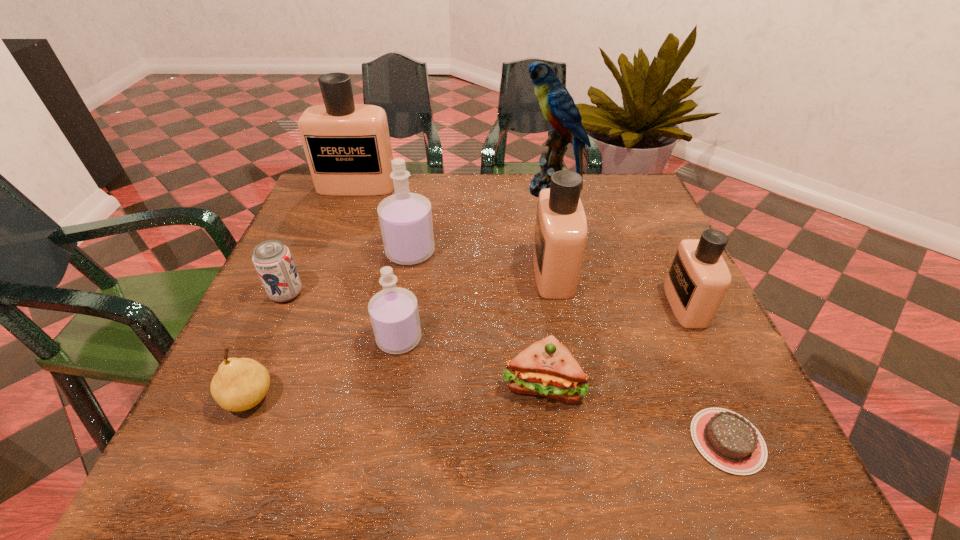
Find the location of a particular element. The image size is (960, 540). parrot is located at coordinates (558, 107).

Find the location of `the biggest beige perfume`. the biggest beige perfume is located at coordinates (347, 146).

This screenshot has height=540, width=960. In order to click on the farthest beige perfume in this screenshot , I will do `click(347, 146)`.

You are a GUI agent. You are given a task and a screenshot of the screen. Output one action in this format:
    pyautogui.click(x=<x>, y=<y>)
    Task: Click on the second smallest beige perfume
    This screenshot has width=960, height=540.
    Given the screenshot: What is the action you would take?
    pyautogui.click(x=560, y=236)

What are the coordinates of `the second beige perfume from right to left` in the screenshot? It's located at (560, 236).

This screenshot has width=960, height=540. In order to click on the bigger purple perfume in this screenshot , I will do `click(405, 218)`.

Image resolution: width=960 pixels, height=540 pixels. Identify the location of the smaller purple perfume. (393, 311).

This screenshot has width=960, height=540. In order to click on the rightmost beige perfume in this screenshot , I will do `click(698, 279)`.

At what (x,y) coordinates should I click in order to perform the action: click on the rightmost perfume. Please return your answer as a coordinate pair (x, y). This screenshot has height=540, width=960. Looking at the image, I should click on (698, 279).

At what (x,y) coordinates should I click in order to perform the action: click on beer can. Please return your answer as a coordinate pair (x, y). Looking at the image, I should click on coord(274,264).